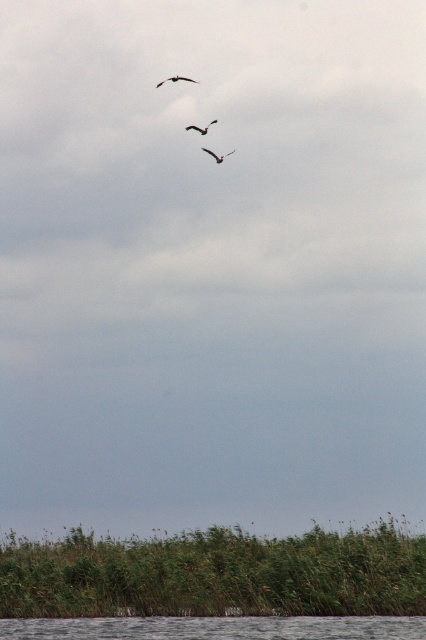
Question: Which object is farther from the camera taking this photo?

Choices:
 (A) gray smooth water at lower center
 (B) dark brown feathered bird at center
 (C) dark brown feathered bird at upper center

Answer: (B)

Question: Which object is the closest to the dark brown feathered bird at center?

Choices:
 (A) dark gray feathered bird at upper center
 (B) gray smooth water at lower center
 (C) dark brown feathered bird at upper center

Answer: (C)

Question: Observing the image, what is the correct spatial positioning of dark gray feathered bird at upper center in reference to dark brown feathered bird at center?

Choices:
 (A) left
 (B) right

Answer: (A)

Question: Does dark brown feathered bird at upper center appear on the left side of dark brown feathered bird at center?

Choices:
 (A) yes
 (B) no

Answer: (A)

Question: Is dark gray feathered bird at upper center to the right of dark brown feathered bird at center from the viewer's perspective?

Choices:
 (A) no
 (B) yes

Answer: (A)

Question: Which object appears closest to the camera in this image?

Choices:
 (A) dark brown feathered bird at upper center
 (B) gray smooth water at lower center
 (C) dark brown feathered bird at center
 (D) dark gray feathered bird at upper center

Answer: (B)